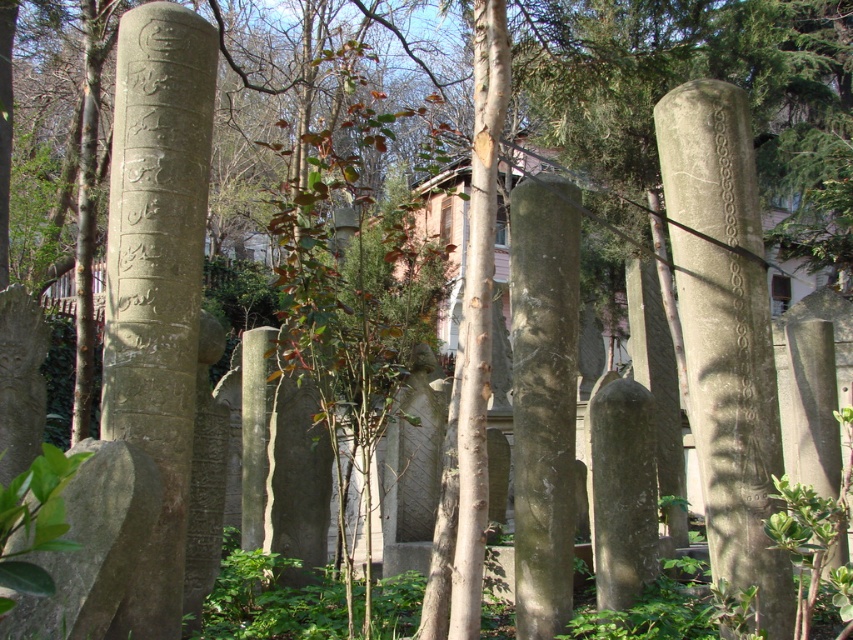
Question: Is gray stone column at center further to camera compared to smooth brown tree trunk at center?

Choices:
 (A) yes
 (B) no

Answer: (A)

Question: Does gray stone pillar at center appear on the right side of green mossy stone pillar at center?

Choices:
 (A) no
 (B) yes

Answer: (A)

Question: Which object is the closest to the gray stone column at center?

Choices:
 (A) smooth brown tree trunk at center
 (B) green mossy stone pillar at center

Answer: (B)

Question: Which point is closer to the camera taking this photo?

Choices:
 (A) (549, 529)
 (B) (166, 465)
 (C) (485, 24)
 (D) (746, 108)

Answer: (C)

Question: Does gray stone column at center appear on the left side of smooth brown tree trunk at center?

Choices:
 (A) yes
 (B) no

Answer: (B)

Question: Which point is farther to the camera?

Choices:
 (A) (461, 388)
 (B) (570, 257)
 (C) (194, 252)

Answer: (B)